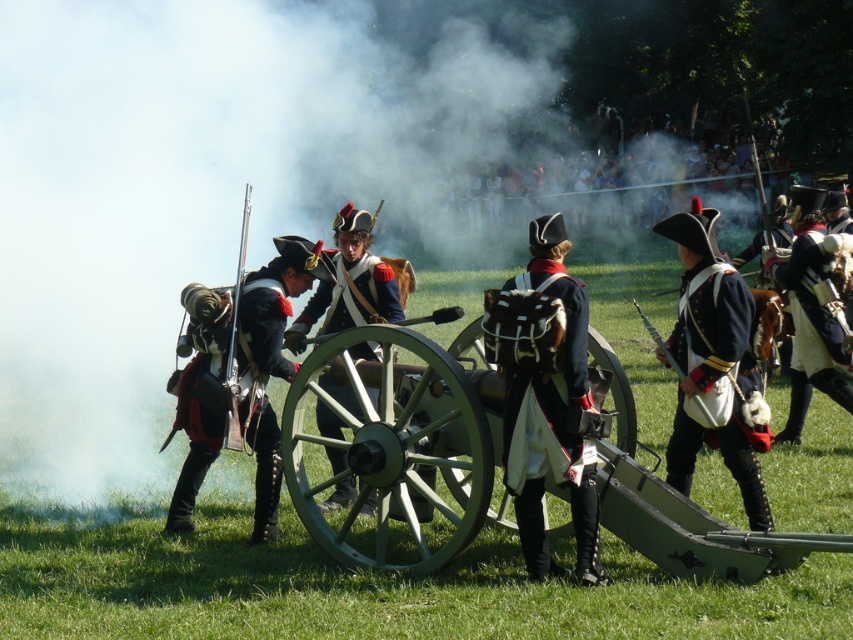
Question: Observing the image, what is the correct spatial positioning of dark blue fabric uniform at center in reference to blue woolen coat at center?

Choices:
 (A) above
 (B) below

Answer: (B)

Question: Estimate the real-world distances between objects in this image. Which object is farther from the blue woolen coat at center?

Choices:
 (A) dark blue fabric uniform at center
 (B) green polished wood cannon at center
 (C) white cotton uniform at right
 (D) matte black uniform at left

Answer: (C)

Question: Is green polished wood cannon at center below blue woolen coat at center?

Choices:
 (A) no
 (B) yes

Answer: (B)

Question: Among these objects, which one is nearest to the camera?

Choices:
 (A) matte blue coat at center
 (B) white cotton uniform at right

Answer: (A)

Question: Can you confirm if matte blue coat at center is wider than blue woolen coat at center?

Choices:
 (A) no
 (B) yes

Answer: (A)

Question: Which of the following is the farthest from the observer?

Choices:
 (A) matte blue coat at center
 (B) blue woolen coat at center

Answer: (B)